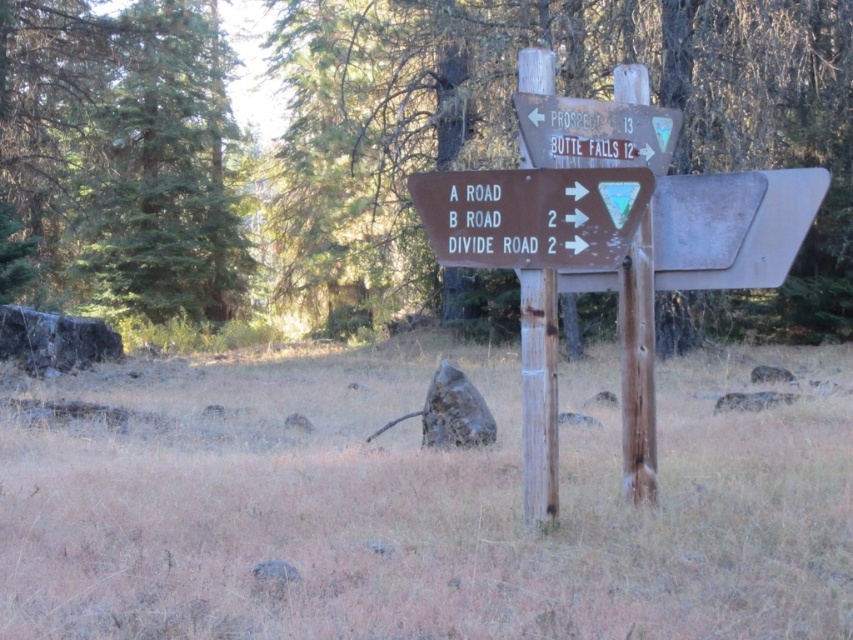
Question: Estimate the real-world distances between objects in this image. Which object is closer to the wooden sign at upper center?

Choices:
 (A) brown wooden sign at center
 (B) brown wood sign at center

Answer: (A)

Question: Does brown wood sign at center have a smaller size compared to wooden sign at upper center?

Choices:
 (A) yes
 (B) no

Answer: (B)

Question: Estimate the real-world distances between objects in this image. Which object is closer to the wooden sign at upper center?

Choices:
 (A) brown wooden sign at center
 (B) brown wood sign at center

Answer: (A)

Question: Does brown wood sign at center appear over wooden sign at upper center?

Choices:
 (A) yes
 (B) no

Answer: (A)

Question: Which point is closer to the camera?

Choices:
 (A) brown wooden sign at center
 (B) wooden sign at upper center

Answer: (A)

Question: Can you confirm if brown wood sign at center is bigger than brown wooden sign at center?

Choices:
 (A) no
 (B) yes

Answer: (B)